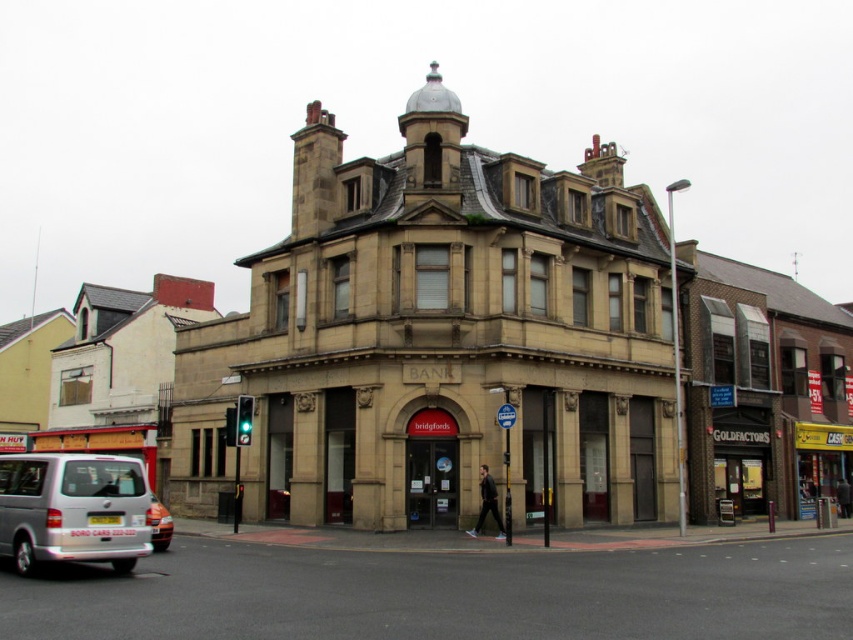
You are a delivery person trying to park your metallic silver van at lower left next to the silver metallic van at lower left. Can both vehicles fit side by side in the available space?

The metallic silver van at lower left is wider than the silver metallic van at lower left, so both vehicles can fit side by side in the available space as long as the total width of both vehicles does not exceed the space provided.

Based on the photo, you are standing at the entrance of the corner building with a red sign. You want to take a photo of the metallic silver van at lower left. Where should you position yourself to capture it in the frame?

To capture the metallic silver van at lower left in the frame, position yourself at the entrance of the corner building with a red sign and aim your camera towards the lower left direction, where the van is located at coordinates approximately 0.928 on the x axis and 0.522 on the y axis.